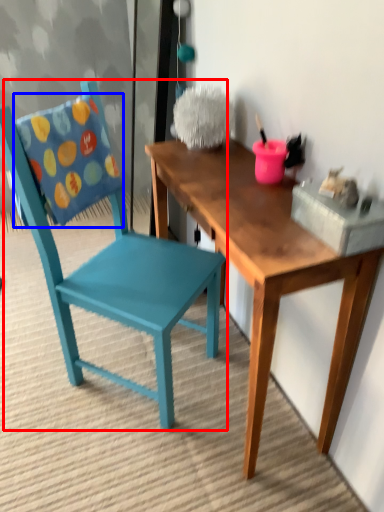
Question: Among these objects, which one is nearest to the camera, chair (highlighted by a red box) or pillow (highlighted by a blue box)?

Choices:
 (A) chair
 (B) pillow

Answer: (A)